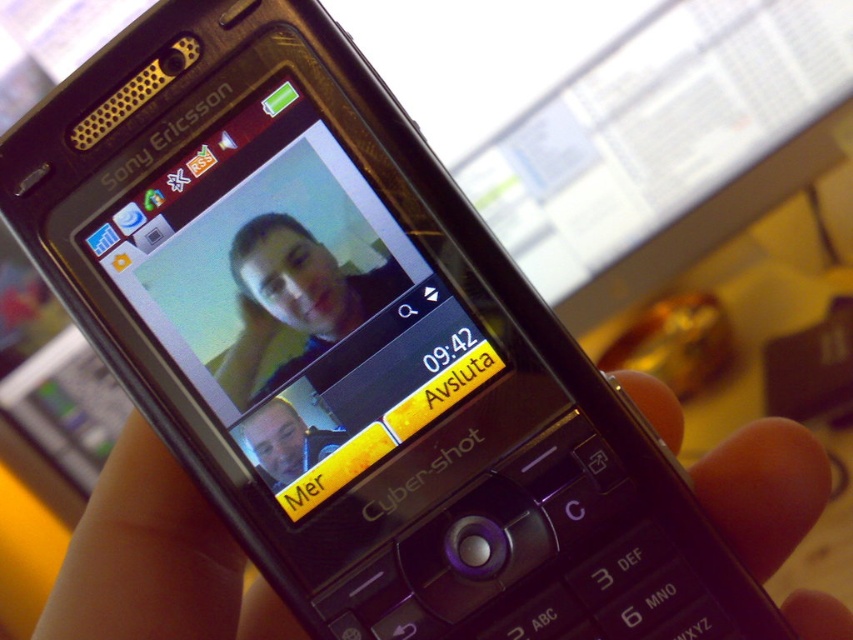
Question: In this image, where is black matte hand at center located relative to matte black face at center?

Choices:
 (A) left
 (B) right

Answer: (A)

Question: Is matte black phone at center wider than matte black face at center?

Choices:
 (A) no
 (B) yes

Answer: (B)

Question: Which is nearer to the matte black face at center?

Choices:
 (A) matte black phone at center
 (B) black matte hand at center

Answer: (A)

Question: Which object is positioned closest to the black matte hand at center?

Choices:
 (A) matte black face at center
 (B) matte black phone at center

Answer: (A)

Question: Can you confirm if black matte hand at center is positioned below matte black phone at center?

Choices:
 (A) yes
 (B) no

Answer: (A)

Question: Based on their relative distances, which object is farther from the matte black phone at center?

Choices:
 (A) black matte hand at center
 (B) matte black face at center

Answer: (A)